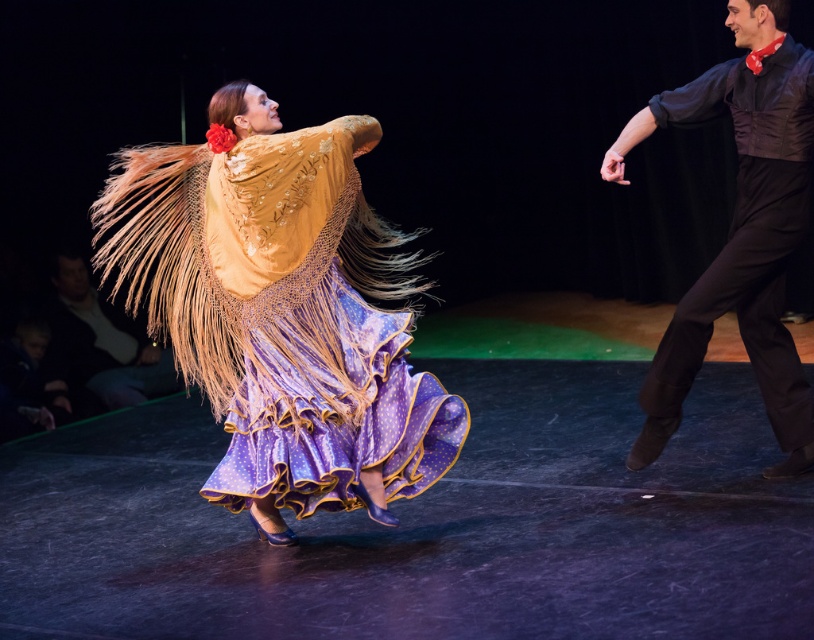
You are a photographer trying to capture the flamenco dance performance. You notice the point at coordinates [282,312] on your camera screen. What object is located at that point?

The point at coordinates [282,312] is occupied by the velvet yellow golden shawl at left.